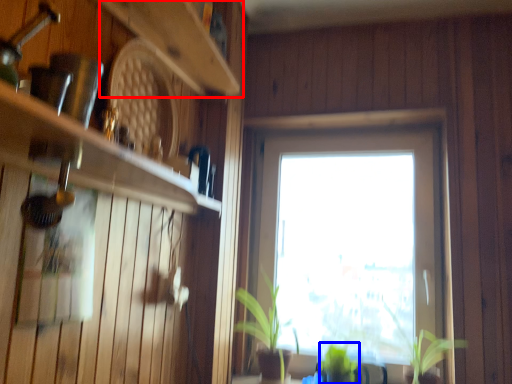
Question: Among these objects, which one is nearest to the camera, shelf (highlighted by a red box) or plant (highlighted by a blue box)?

Choices:
 (A) shelf
 (B) plant

Answer: (A)